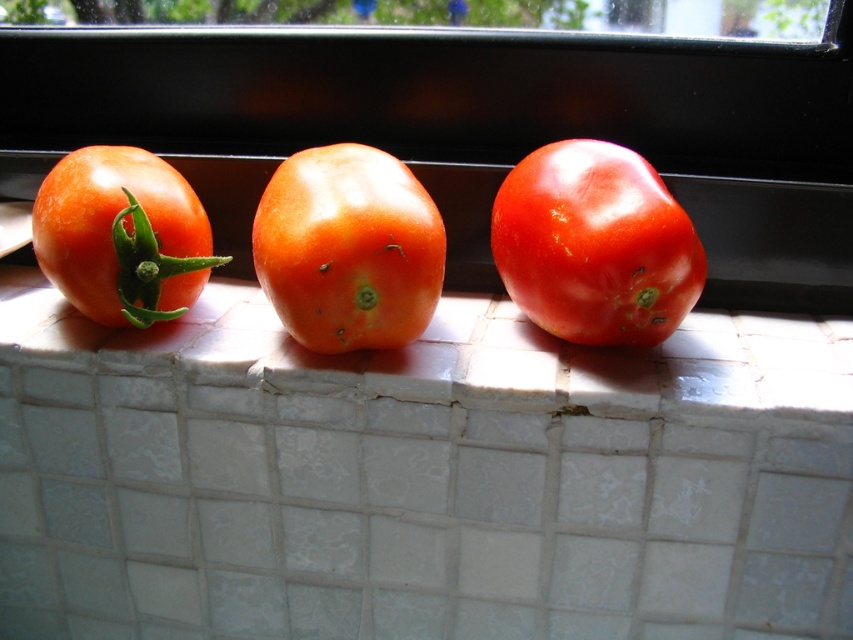
Which is above, glossy orange tomato at center or glossy matte tomato at left?

glossy orange tomato at center is above.

Who is more distant from viewer, (410, 212) or (100, 264)?

Point (100, 264)

Is point (306, 152) positioned behind point (171, 234)?

Yes, point (306, 152) is farther from viewer.

Locate an element on the screen. glossy orange tomato at center is located at coordinates (347, 248).

Can you confirm if glossy red tomato at center is shorter than glossy matte tomato at left?

Incorrect, glossy red tomato at center's height does not fall short of glossy matte tomato at left's.

Does glossy red tomato at center come behind glossy matte tomato at left?

No, it is not.

Is point (653, 326) positioned after point (137, 220)?

Yes, it is behind point (137, 220).

Locate an element on the screen. This screenshot has width=853, height=640. glossy red tomato at center is located at coordinates (595, 244).

Is glossy red tomato at center further to camera compared to glossy orange tomato at center?

Yes, it is behind glossy orange tomato at center.

Is point (692, 291) farther from viewer compared to point (302, 273)?

Yes.

Which is behind, point (635, 300) or point (393, 161)?

The point (393, 161) is behind.

Locate an element on the screen. Image resolution: width=853 pixels, height=640 pixels. glossy red tomato at center is located at coordinates (595, 244).